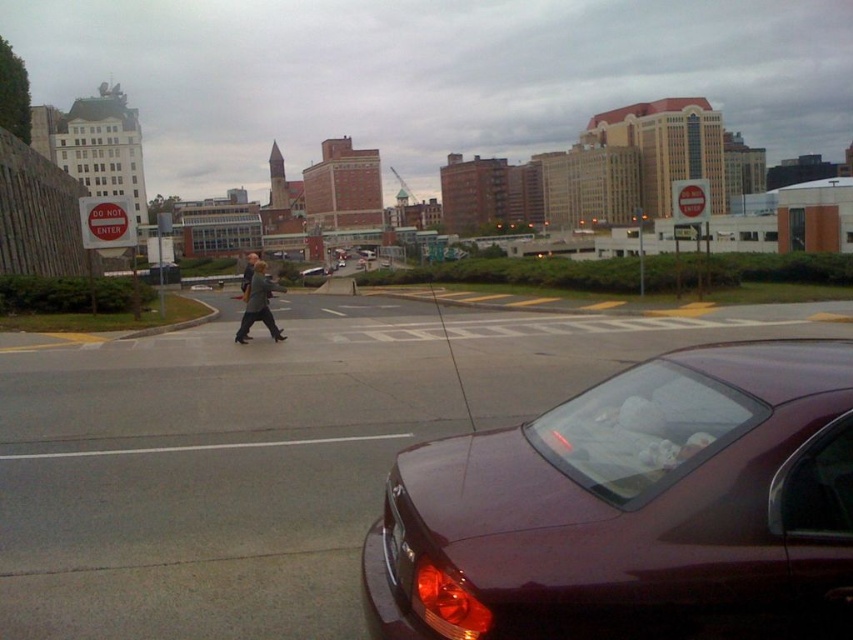
You are a delivery person needing to pass through the area between the glossy maroon car at lower right and the dark gray jacket at center. Can your 1.2 meter wide delivery cart fit through this space?

The glossy maroon car at lower right has a lesser width compared to dark gray jacket at center, so the space between them is at least as wide as the car. Since the car is narrower than the jacket, the available space might be sufficient. However, without exact distance measurements, it is uncertain. The delivery cart is 1.2 meters wide, so if the space between the car and the pedestrian is wider than 1.2 meters, it can fit. But since the car is narrower, it might create a narrower passage. The answer is not

You are a pedestrian standing at the crosswalk. You see the glossy maroon car at lower right and the dark gray jacket at center. Which object is closer to you?

The dark gray jacket at center is closer to you because the glossy maroon car at lower right is below it, meaning it is positioned further back in the scene.

You are a delivery person standing at the camera position. You need to place a package on the hood of the glossy maroon car at lower right. Can you reach the car without moving from your current position?

The glossy maroon car at lower right and camera are 2.21 meters apart. Since the distance is within a typical arm reach for placing an object, you can likely reach the car without moving from your current position.